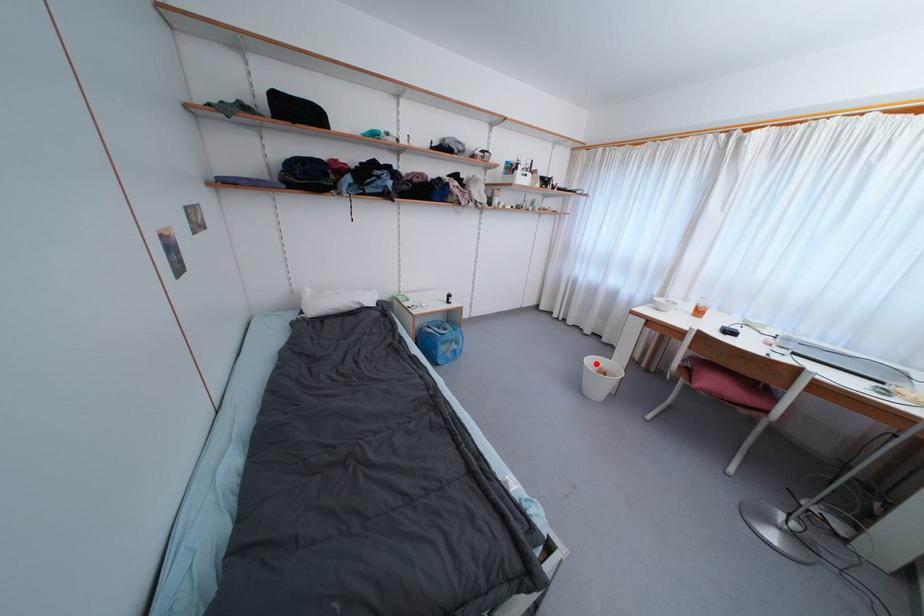
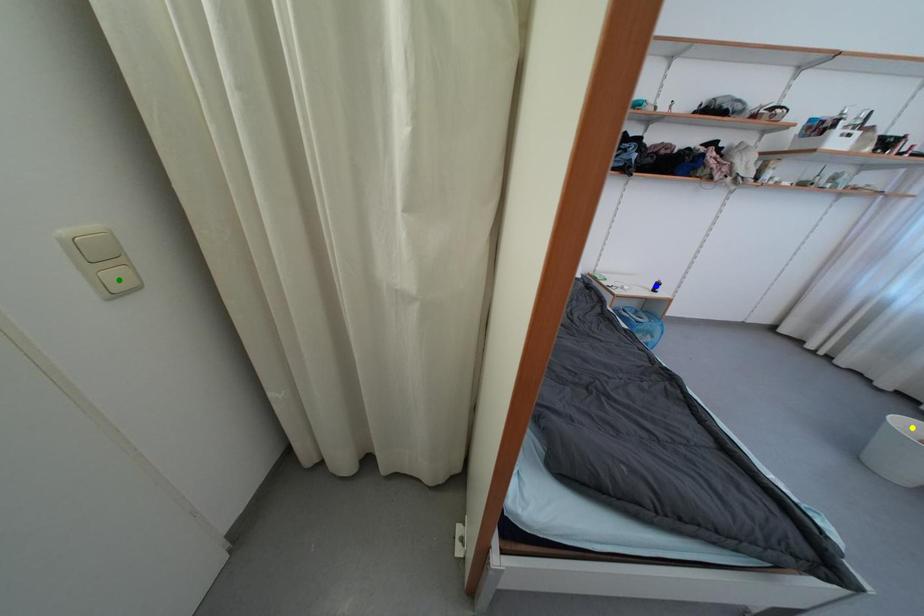
Question: I am providing you with two images of the same scene from different viewpoints. A red point is marked on the first image. You are given multiple points on the second image. Which point in image 2 represents the same 3d spot as the red point in image 1?

Choices:
 (A) yellow point
 (B) green point
 (C) blue point

Answer: (A)